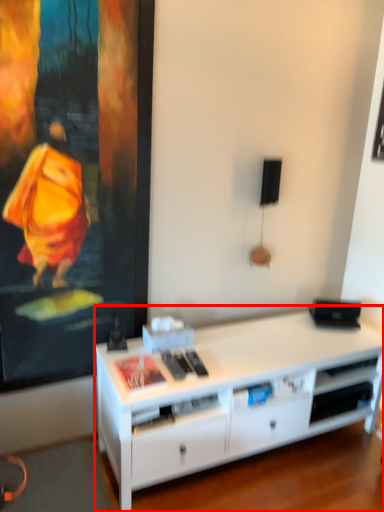
Question: Where is desk (annotated by the red box) located in relation to shelf in the image?

Choices:
 (A) left
 (B) right

Answer: (A)